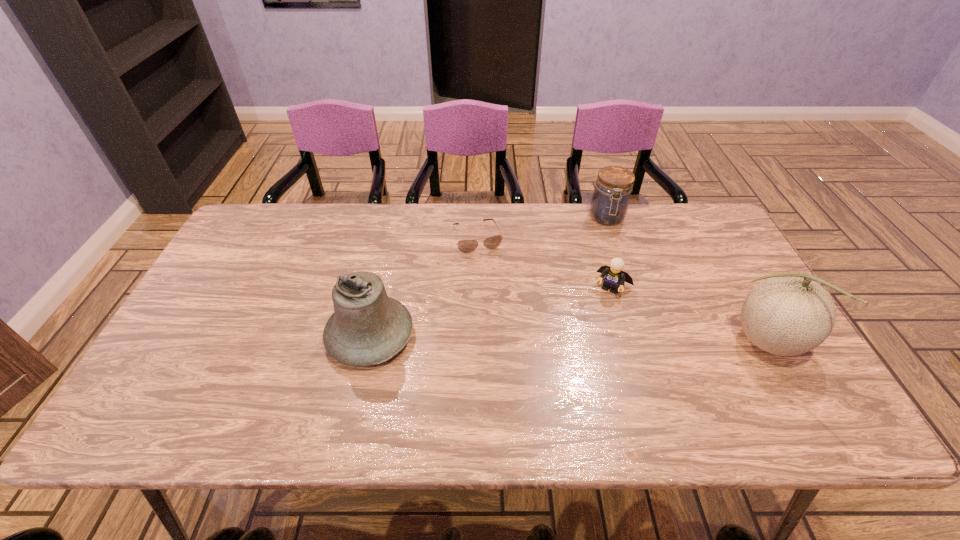
You are a GUI agent. You are given a task and a screenshot of the screen. Output one action in this format:
    pyautogui.click(x=<x>, y=<y>)
    Task: Click on the free space that satisfies the following two spatial constraints: 1. on the front side of the third tallest object; 2. on the right side of the rightmost object
    The width and height of the screenshot is (960, 540).
    Given the screenshot: What is the action you would take?
    pyautogui.click(x=648, y=342)

Where is `blank area in the image that satisfies the following two spatial constraints: 1. on the back side of the fourth tallest object; 2. on the left side of the jar`? blank area in the image that satisfies the following two spatial constraints: 1. on the back side of the fourth tallest object; 2. on the left side of the jar is located at coordinates (592, 218).